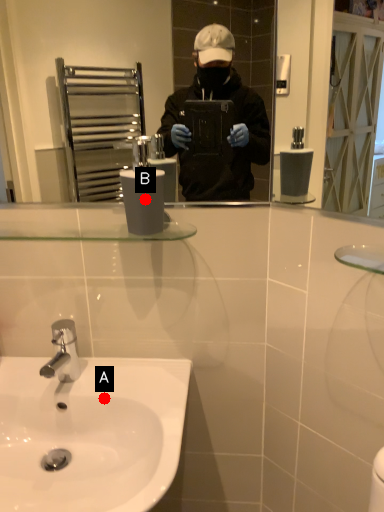
Question: Two points are circled on the image, labeled by A and B beside each circle. Among these points, which one is farthest from the camera?

Choices:
 (A) A is further
 (B) B is further

Answer: (A)